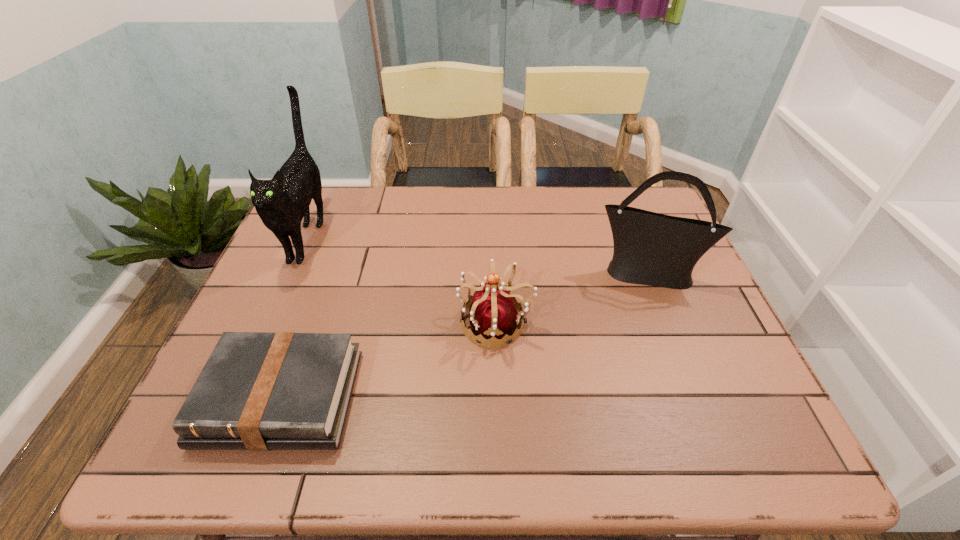
This screenshot has height=540, width=960. What are the coordinates of `vacant region located 0.120m on the front-facing side of the third object from left to right` in the screenshot? It's located at (408, 323).

Locate an element on the screen. object that is at the far edge is located at coordinates (282, 202).

Find the location of `object that is at the near edge`. object that is at the near edge is located at coordinates (259, 391).

I want to click on cat located at the left edge, so click(282, 202).

Find the location of a particular element. This screenshot has height=540, width=960. hardback book located at the left edge is located at coordinates (259, 391).

This screenshot has width=960, height=540. Find the location of `object present at the right edge`. object present at the right edge is located at coordinates pyautogui.click(x=653, y=249).

Find the location of `object that is at the far left corner`. object that is at the far left corner is located at coordinates (282, 202).

The height and width of the screenshot is (540, 960). I want to click on object at the near left corner, so click(259, 391).

Identify the location of vacant space at the far edge. point(509,221).

At what (x,y) coordinates should I click in order to perform the action: click on vacant space at the near edge of the desktop. Please return your answer as a coordinate pair (x, y). Image resolution: width=960 pixels, height=540 pixels. Looking at the image, I should click on (568, 447).